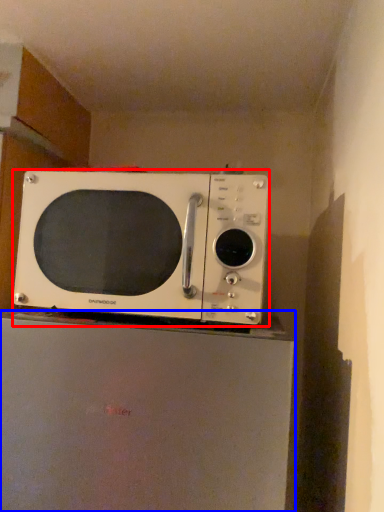
Question: Which point is further to the camera, microwave oven (highlighted by a red box) or appliance (highlighted by a blue box)?

Choices:
 (A) microwave oven
 (B) appliance

Answer: (A)